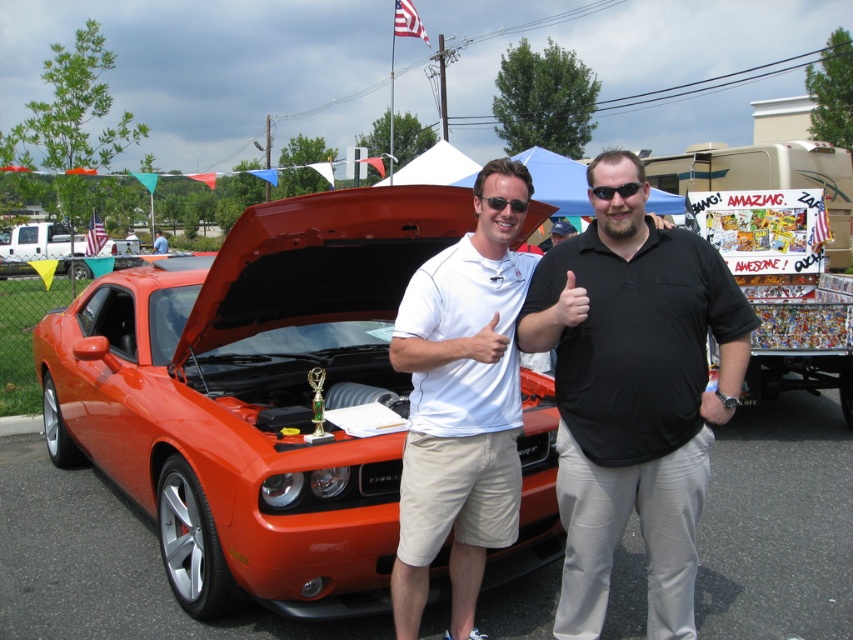
Question: Does black plastic sunglasses at center lie behind black matte shirt at center?

Choices:
 (A) yes
 (B) no

Answer: (B)

Question: Among these objects, which one is farthest from the camera?

Choices:
 (A) black matte shirt at center
 (B) black plastic sunglasses at center

Answer: (A)

Question: Which point appears farthest from the camera in this image?

Choices:
 (A) (682, 342)
 (B) (566, 228)

Answer: (B)

Question: Can you confirm if white cotton polo shirt at center is smaller than matte black shirt at center?

Choices:
 (A) yes
 (B) no

Answer: (A)

Question: Which point appears closest to the camera in this image?

Choices:
 (A) (524, 205)
 (B) (524, 445)
 (C) (563, 227)

Answer: (A)

Question: Does orange matte car at center come in front of black matte shirt at center?

Choices:
 (A) yes
 (B) no

Answer: (A)